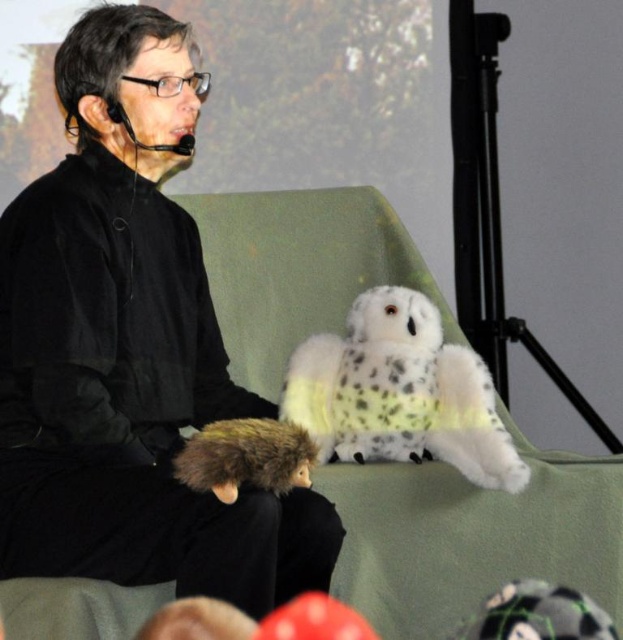
Is black matte plush toy at center further to the viewer compared to white fluffy owl at center?

No, black matte plush toy at center is in front of white fluffy owl at center.

Where is `black matte plush toy at center`? The image size is (623, 640). black matte plush toy at center is located at coordinates (128, 348).

Locate an element on the screen. black matte plush toy at center is located at coordinates (128, 348).

Does black matte plush toy at center have a larger size compared to green fabric armchair at center?

No.

Is point (75, 100) closer to camera compared to point (464, 497)?

Yes, point (75, 100) is in front of point (464, 497).

Find the location of a particular element. This screenshot has width=623, height=640. black matte plush toy at center is located at coordinates (128, 348).

I want to click on black matte plush toy at center, so click(128, 348).

Describe the element at coordinates (472, 536) in the screenshot. The height and width of the screenshot is (640, 623). I see `green fabric armchair at center` at that location.

Between green fabric armchair at center and white fluffy owl at center, which one is positioned lower?

white fluffy owl at center is lower down.

This screenshot has width=623, height=640. In order to click on green fabric armchair at center in this screenshot , I will do `click(472, 536)`.